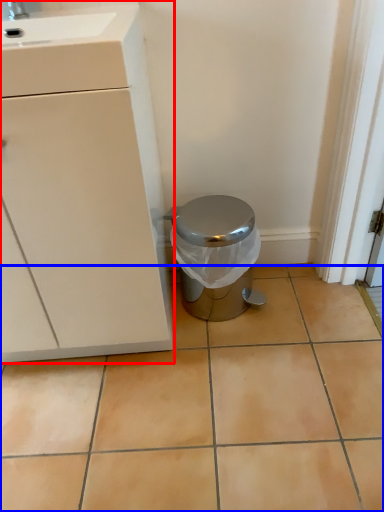
Question: Among these objects, which one is nearest to the camera, cabinetry (highlighted by a red box) or ceramic tile (highlighted by a blue box)?

Choices:
 (A) cabinetry
 (B) ceramic tile

Answer: (A)